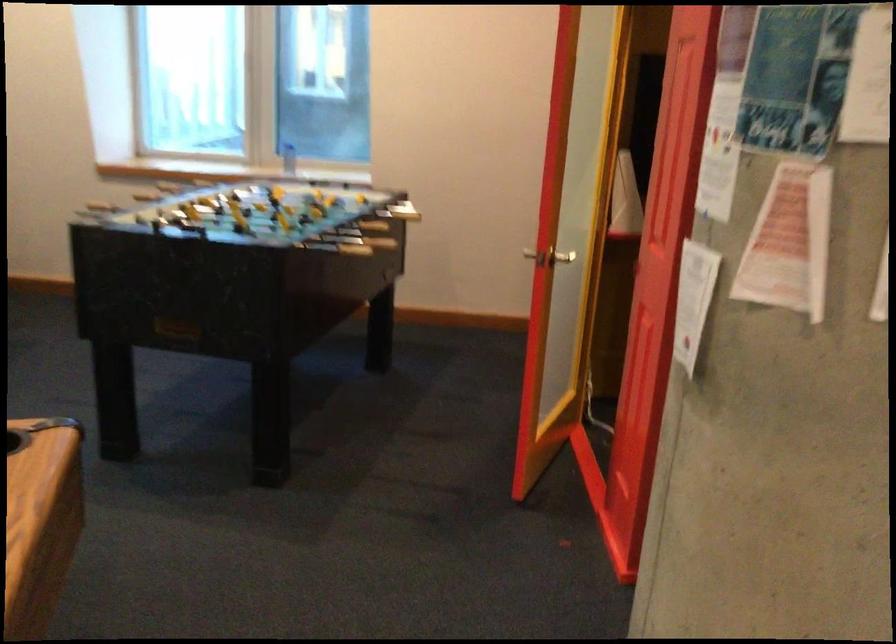
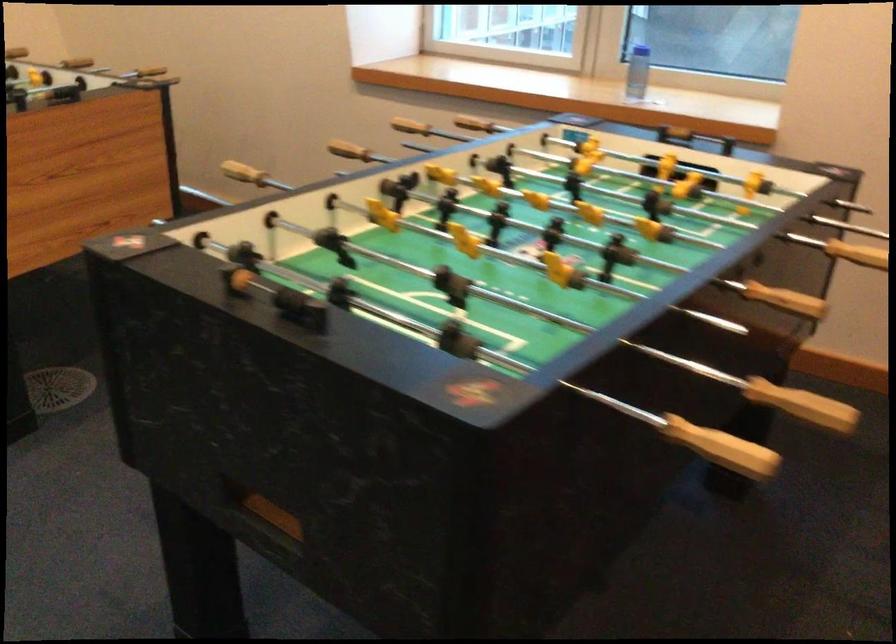
In the second image, find the point that corresponds to (x=97, y=198) in the first image.

(243, 172)